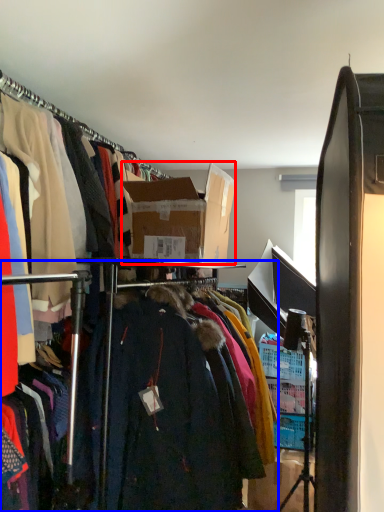
Question: Which object appears closest to the camera in this image, box (highlighted by a red box) or closet (highlighted by a blue box)?

Choices:
 (A) box
 (B) closet

Answer: (B)